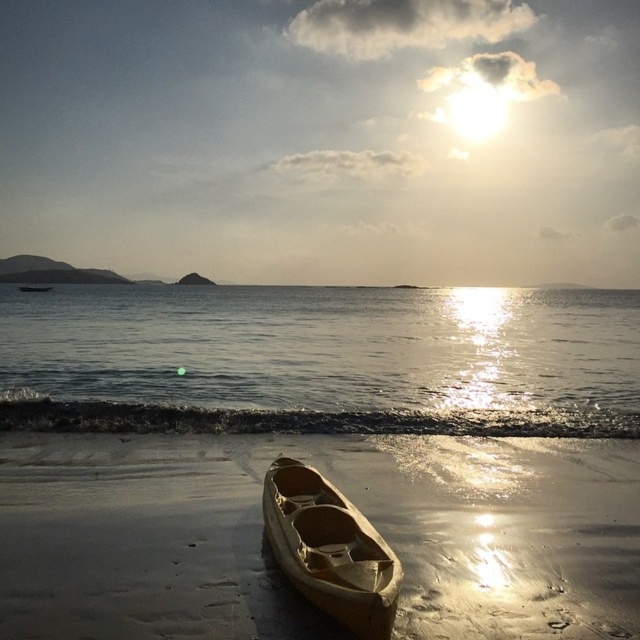
Between clear water at lower center and wooden canoe at center, which one has more height?

clear water at lower center

Is clear water at lower center closer to camera compared to wooden canoe at center?

No, it is behind wooden canoe at center.

The height and width of the screenshot is (640, 640). Describe the element at coordinates (321, 360) in the screenshot. I see `clear water at lower center` at that location.

Locate an element on the screen. This screenshot has width=640, height=640. clear water at lower center is located at coordinates (321, 360).

Does smooth sand at lower center have a smaller size compared to clear water at lower center?

Yes.

Can you confirm if smooth sand at lower center is bigger than clear water at lower center?

Incorrect, smooth sand at lower center is not larger than clear water at lower center.

Between point (161, 609) and point (147, 349), which one is positioned in front?

Point (161, 609) is more forward.

The height and width of the screenshot is (640, 640). In order to click on smooth sand at lower center in this screenshot , I will do `click(269, 556)`.

Is smooth sand at lower center shorter than wooden canoe at center?

Indeed, smooth sand at lower center has a lesser height compared to wooden canoe at center.

The width and height of the screenshot is (640, 640). Find the location of `smooth sand at lower center`. smooth sand at lower center is located at coordinates (269, 556).

I want to click on smooth sand at lower center, so click(269, 556).